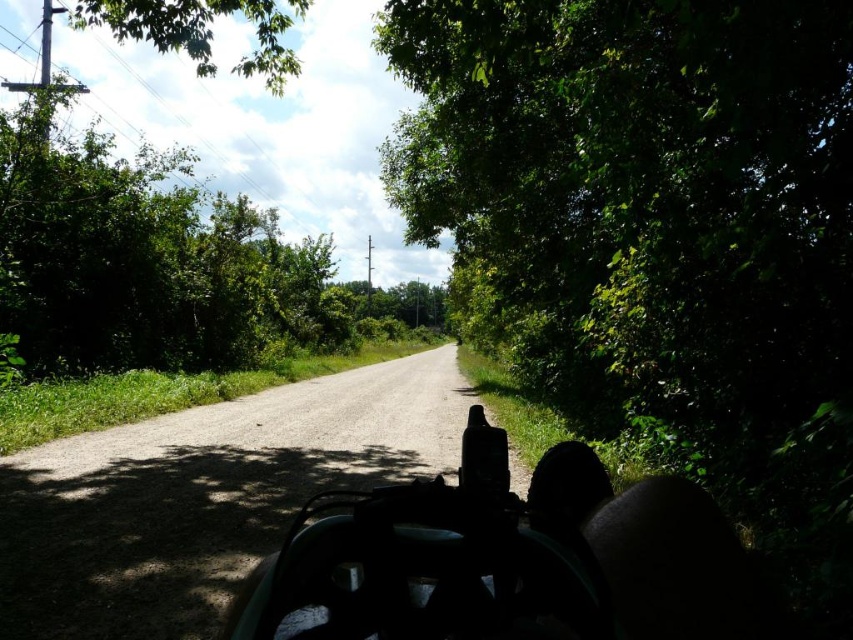
You are riding a four wheeler and see a green plastic baby carriage at center and a green leafy tree at upper center. Which object takes up more space in the image?

The green leafy tree at upper center takes up more space in the image than the green plastic baby carriage at center.

You are riding a four wheeler on a narrow dirt road and see a green plastic baby carriage at center and a green leafy tree at upper center. How far apart are these two objects from each other?

The green plastic baby carriage at center and green leafy tree at upper center are 90.44 feet apart from each other.